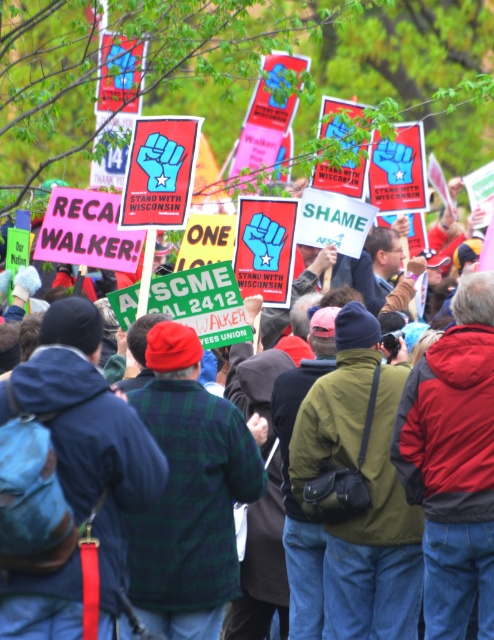
You are a photographer at the protest scene and want to capture a photo of both the red jacket at center and the green fabric jacket at center. Based on their positions, which jacket should you focus on first to ensure both are in the frame?

The red jacket at center is to the right of the green fabric jacket at center. To ensure both are in the frame, focus on the green fabric jacket at center first as it is on the left, then adjust the camera to include the red jacket at center on the right.

You are a photographer standing in the crowd at the protest. You want to take a photo that includes both the point at (490, 433) and the point at (310, 616). Which point should you focus on first to ensure both are in sharp focus?

You should focus on the point at (490, 433) first because it is closer to you than the point at (310, 616). By focusing on the closer point, the farther point will also be within the depth of field and appear sharp in the photo.

You are a photographer at the protest scene. You want to capture a photo of the green fabric jacket at center and the green plaid shirt at center. Which one is positioned lower in the frame?

The green fabric jacket at center is located below the green plaid shirt at center, so it is positioned lower in the frame.